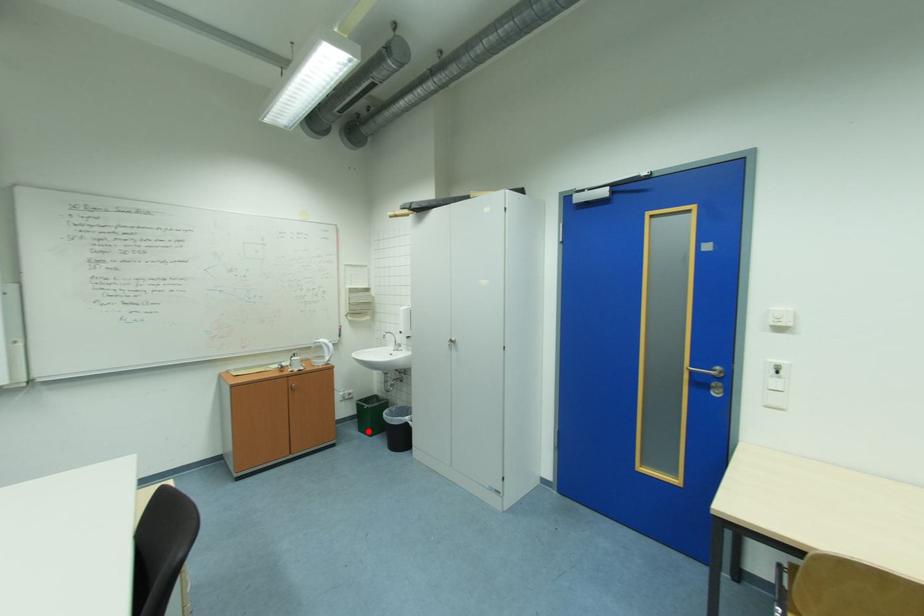
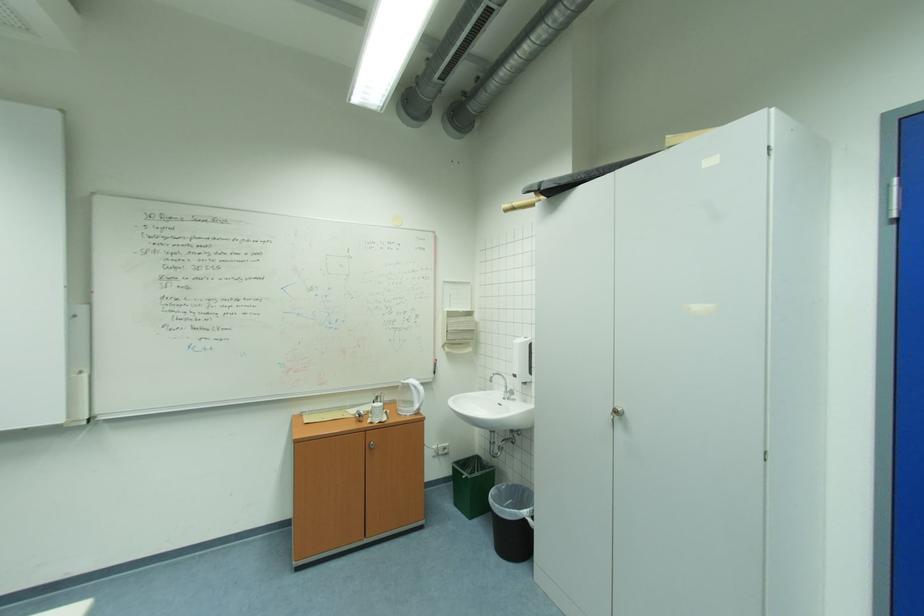
Locate, in the second image, the point that corresponds to the highlighted location in the first image.

(464, 505)